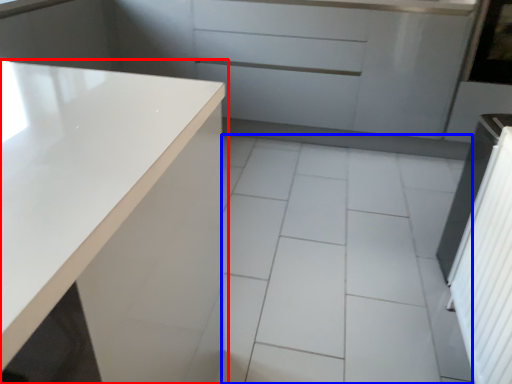
Question: Which of the following is the farthest to the observer, countertop (highlighted by a red box) or ceramic tile (highlighted by a blue box)?

Choices:
 (A) countertop
 (B) ceramic tile

Answer: (B)